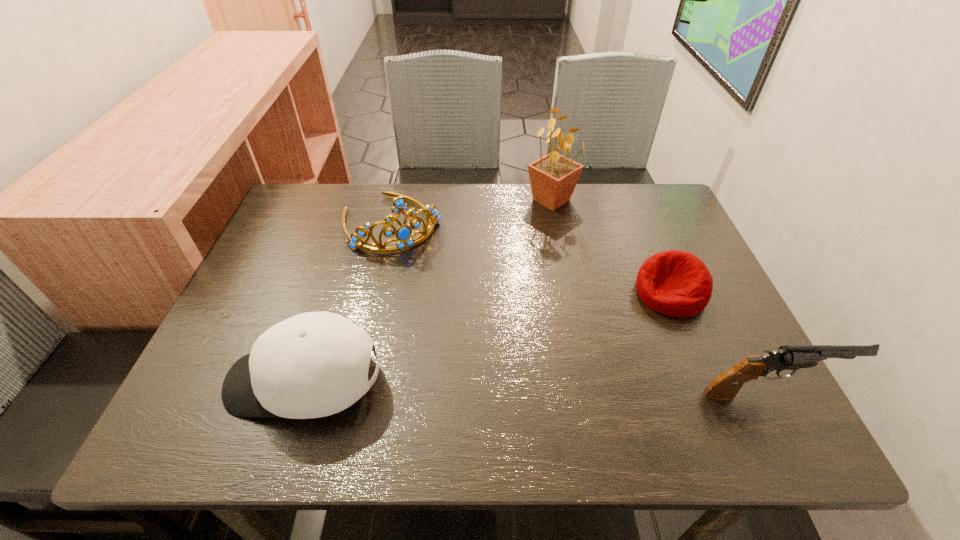
Where is `object that is the third closest one to the shortest object`? The height and width of the screenshot is (540, 960). object that is the third closest one to the shortest object is located at coordinates (403, 234).

You are a GUI agent. You are given a task and a screenshot of the screen. Output one action in this format:
    pyautogui.click(x=<x>, y=<y>)
    Task: Click on the free space that satisfies the following two spatial constraints: 1. on the front side of the shortest object; 2. along the barrel of the gun
    The height and width of the screenshot is (540, 960).
    Given the screenshot: What is the action you would take?
    point(712,393)